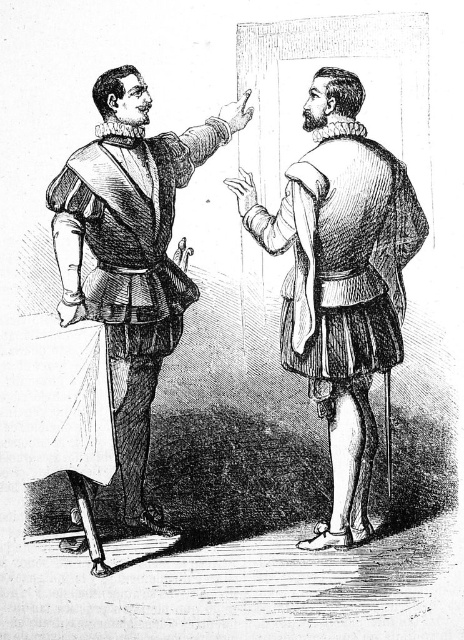
Question: Among these objects, which one is nearest to the camera?

Choices:
 (A) matte black armor at left
 (B) etched paper robe at center

Answer: (A)

Question: Is etched paper robe at center thinner than matte black armor at left?

Choices:
 (A) no
 (B) yes

Answer: (A)

Question: Is etched paper robe at center wider than matte black armor at left?

Choices:
 (A) no
 (B) yes

Answer: (B)

Question: Which point is farther to the camera?

Choices:
 (A) (114, 392)
 (B) (371, 372)

Answer: (B)

Question: In this image, where is etched paper robe at center located relative to matte black armor at left?

Choices:
 (A) left
 (B) right

Answer: (B)